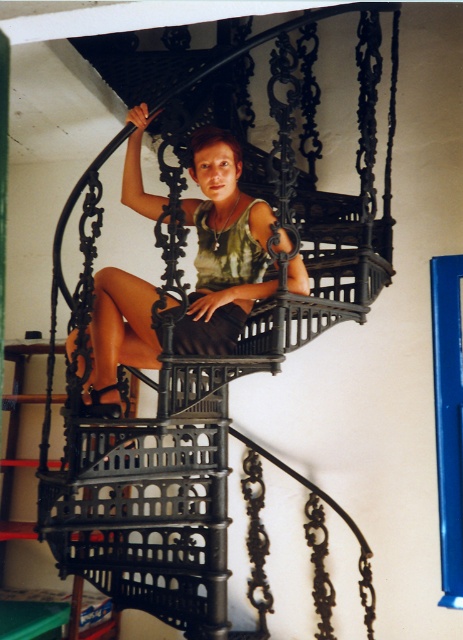
Consider the image. You are a fashion designer observing the image and need to determine which garment is wider between the matte green tank top at center and the green matte dress at center. Which one is wider?

The matte green tank top at center is wider than the green matte dress at center according to the description.

You are standing in a room with a spiral staircase. You notice a point at coordinates (224,244). What object is located at that point?

The point at coordinates (224,244) indicates the matte green tank top at center.

You are an interior designer assessing the placement of clothing items in a photo. You notice a matte green tank top at center and a green matte dress at center. Which clothing item is positioned more to the left side of the image?

The matte green tank top at center is positioned more to the left side of the image compared to the green matte dress at center.